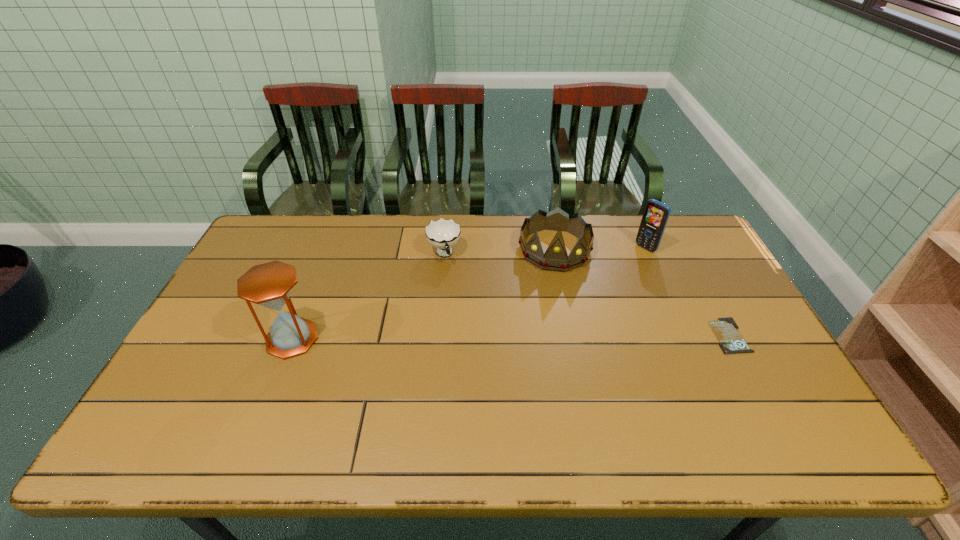
This screenshot has width=960, height=540. I want to click on the fourth closest object to the identity card, so click(269, 285).

At what (x,y) coordinates should I click in order to perform the action: click on object that can be found as the third closest to the rightmost object. Please return your answer as a coordinate pair (x, y). Looking at the image, I should click on (443, 234).

The width and height of the screenshot is (960, 540). What are the coordinates of `vacant space that satisfies the following two spatial constraints: 1. on the back side of the cellular telephone; 2. on the left side of the fourth tallest object` in the screenshot? It's located at (444, 248).